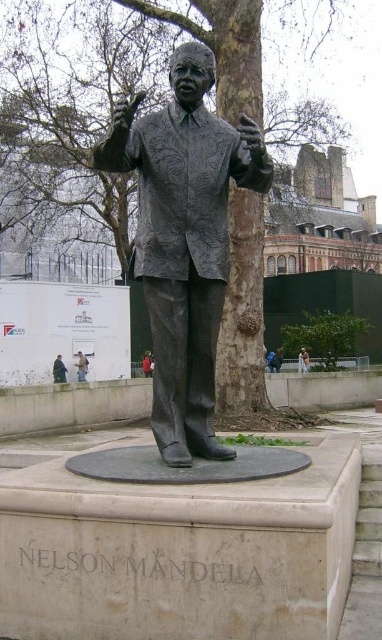
Question: Which point is closer to the camera?

Choices:
 (A) brown textured tree at center
 (B) green leafy tree at center
 (C) bronze statue at center

Answer: (C)

Question: Among these objects, which one is farthest from the camera?

Choices:
 (A) green leafy tree at center
 (B) bronze statue at center
 (C) brown textured tree at center

Answer: (A)

Question: Which point is farther to the camera?

Choices:
 (A) (258, 92)
 (B) (310, 337)
 (C) (184, 321)

Answer: (B)

Question: Is brown textured tree at center smaller than green leafy tree at center?

Choices:
 (A) no
 (B) yes

Answer: (A)

Question: Can you confirm if bronze statue at center is positioned to the left of brown textured tree at center?

Choices:
 (A) yes
 (B) no

Answer: (A)

Question: Is brown textured tree at center wider than green leafy tree at center?

Choices:
 (A) yes
 (B) no

Answer: (A)